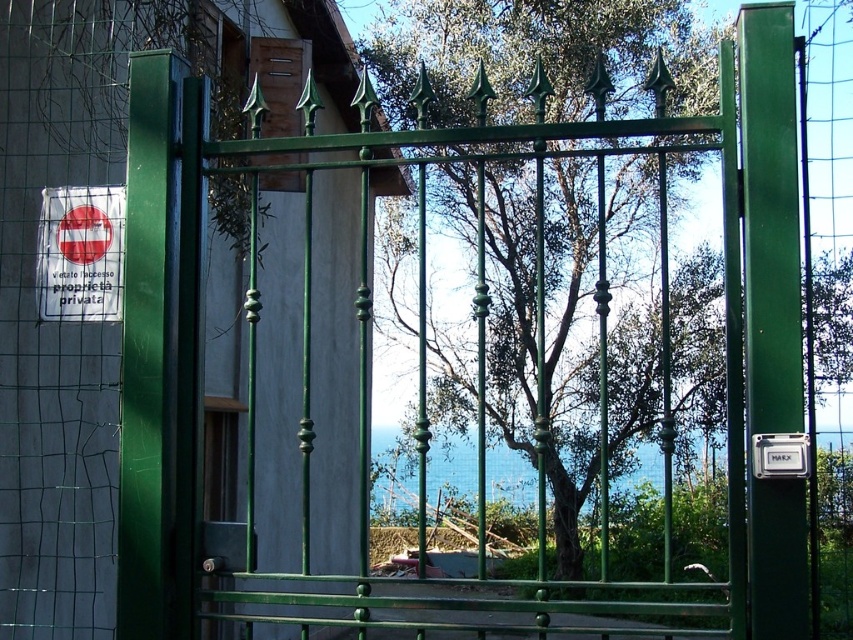
Based on the photo, you are standing in front of the green metal gate with pointed finials. You notice a green metal tree at center. Where is the green metal tree positioned relative to the gate?

The green metal tree at center is located at point (538, 54) relative to the gate.

You are a painter standing at the entrance of the property. You need to paint both the green metal tree at center and the white plastic parking sign at right. Which object will require you to use a ladder to reach its top?

The green metal tree at center has a greater height compared to the white plastic parking sign at right, so you will need a ladder to reach the top of the green metal tree at center.

You are standing at the point at coordinates point (546, 404) and want to walk towards the green metal gate with pointed finials at the top. Is the distance between you and the gate sufficient to allow you to walk straight to it without needing to detour around any obstacles?

The distance between you and the green metal gate with pointed finials at the top is 14.73 meters, so yes, you can walk straight to it without needing to detour around any obstacles as there are no mentioned obstacles in the scene description.